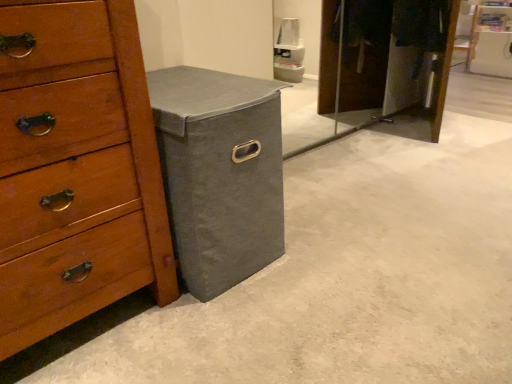
Locate an element on the screen. The image size is (512, 384). wooden chest of drawers at left is located at coordinates (77, 168).

The image size is (512, 384). Describe the element at coordinates (77, 168) in the screenshot. I see `wooden chest of drawers at left` at that location.

What is the approximate width of wooden chest of drawers at left?

22.24 inches.

In order to face wooden chest of drawers at left, should I rotate leftwards or rightwards?

Rotate left and turn 26.837 degrees.

The height and width of the screenshot is (384, 512). I want to click on gray fabric storage bin at lower left, so click(220, 173).

Measure the distance between gray fabric storage bin at lower left and camera.

gray fabric storage bin at lower left is 3.41 feet from camera.

The height and width of the screenshot is (384, 512). What do you see at coordinates (220, 173) in the screenshot?
I see `gray fabric storage bin at lower left` at bounding box center [220, 173].

Where is `wooden chest of drawers at left`? wooden chest of drawers at left is located at coordinates (77, 168).

Which is more to the right, wooden chest of drawers at left or gray fabric storage bin at lower left?

gray fabric storage bin at lower left.

Is wooden chest of drawers at left in front of or behind gray fabric storage bin at lower left in the image?

wooden chest of drawers at left is positioned closer to the viewer than gray fabric storage bin at lower left.

Is point (159, 223) less distant than point (220, 271)?

Yes.

From the image's perspective, is wooden chest of drawers at left below gray fabric storage bin at lower left?

Yes, from the image's perspective, wooden chest of drawers at left is below gray fabric storage bin at lower left.

From a real-world perspective, between wooden chest of drawers at left and gray fabric storage bin at lower left, who is vertically lower?

From a 3D spatial view, gray fabric storage bin at lower left is below.

Looking at their sizes, would you say wooden chest of drawers at left is wider or thinner than gray fabric storage bin at lower left?

Considering their sizes, wooden chest of drawers at left looks slimmer than gray fabric storage bin at lower left.

From the picture: Can you confirm if wooden chest of drawers at left is taller than gray fabric storage bin at lower left?

Yes.

Which of these two, wooden chest of drawers at left or gray fabric storage bin at lower left, is smaller?

With smaller size is gray fabric storage bin at lower left.

Can gray fabric storage bin at lower left be found inside wooden chest of drawers at left?

Definitely not — gray fabric storage bin at lower left is not inside wooden chest of drawers at left.

Are wooden chest of drawers at left and gray fabric storage bin at lower left making contact?

No, wooden chest of drawers at left is not with gray fabric storage bin at lower left.

Is wooden chest of drawers at left facing away from gray fabric storage bin at lower left?

No, wooden chest of drawers at left is not facing the opposite direction of gray fabric storage bin at lower left.

How different are the orientations of wooden chest of drawers at left and gray fabric storage bin at lower left in degrees?

0.227 degrees separate the facing orientations of wooden chest of drawers at left and gray fabric storage bin at lower left.

Locate an element on the screen. the chest of drawers in front of the gray fabric storage bin at lower left is located at coordinates (77, 168).

Between gray fabric storage bin at lower left and wooden chest of drawers at left, which one appears on the left side from the viewer's perspective?

wooden chest of drawers at left is more to the left.

Is the depth of gray fabric storage bin at lower left less than that of wooden chest of drawers at left?

No, it is behind wooden chest of drawers at left.

Which is behind, point (177, 216) or point (14, 173)?

Point (177, 216)

From the image's perspective, is gray fabric storage bin at lower left located above wooden chest of drawers at left?

Correct, gray fabric storage bin at lower left appears higher than wooden chest of drawers at left in the image.

In the scene shown: From a real-world perspective, relative to wooden chest of drawers at left, is gray fabric storage bin at lower left vertically above or below?

gray fabric storage bin at lower left is situated lower than wooden chest of drawers at left in the real world.

Looking at this image, which of these two, gray fabric storage bin at lower left or wooden chest of drawers at left, is wider?

gray fabric storage bin at lower left.

Can you confirm if gray fabric storage bin at lower left is shorter than wooden chest of drawers at left?

Indeed, gray fabric storage bin at lower left has a lesser height compared to wooden chest of drawers at left.

Can you confirm if gray fabric storage bin at lower left is bigger than wooden chest of drawers at left?

Actually, gray fabric storage bin at lower left might be smaller than wooden chest of drawers at left.

Is gray fabric storage bin at lower left completely or partially outside of wooden chest of drawers at left?

Indeed, gray fabric storage bin at lower left is completely outside wooden chest of drawers at left.

Are gray fabric storage bin at lower left and wooden chest of drawers at left far apart?

Actually, gray fabric storage bin at lower left and wooden chest of drawers at left are a little close together.

Is gray fabric storage bin at lower left positioned with its back to wooden chest of drawers at left?

gray fabric storage bin at lower left does not have its back to wooden chest of drawers at left.

Find the location of a particular element. chest of drawers on the left of gray fabric storage bin at lower left is located at coordinates (77, 168).

Find the location of `cabinetry behind the wooden chest of drawers at left`. cabinetry behind the wooden chest of drawers at left is located at coordinates coord(220,173).

Where is `cabinetry beneath the wooden chest of drawers at left (from a real-world perspective)`? cabinetry beneath the wooden chest of drawers at left (from a real-world perspective) is located at coordinates (220, 173).